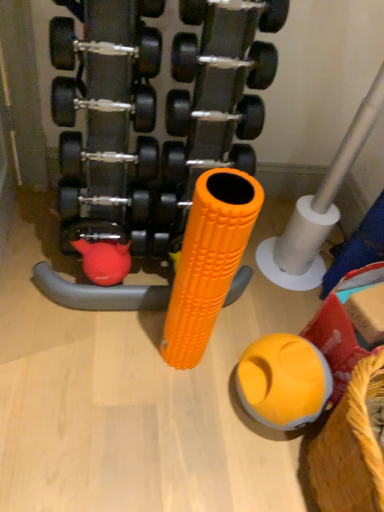
Locate an element on the screen. This screenshot has width=384, height=512. vacant region to the left of yellow woven basket at lower right is located at coordinates (227, 439).